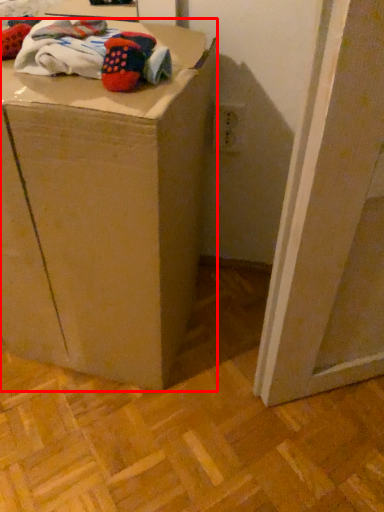
Question: From the image's perspective, where is furniture (annotated by the red box) located in relation to laundry in the image?

Choices:
 (A) below
 (B) above

Answer: (A)